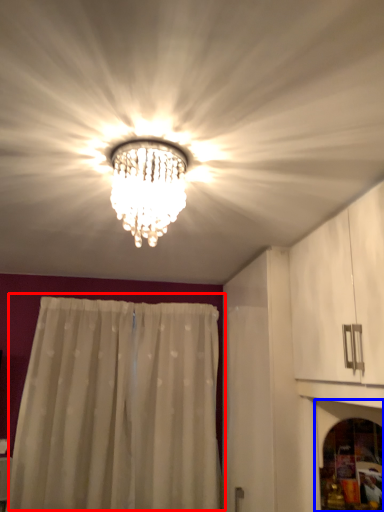
Question: Which point is closer to the camera, curtain (highlighted by a red box) or screen door (highlighted by a blue box)?

Choices:
 (A) curtain
 (B) screen door

Answer: (B)